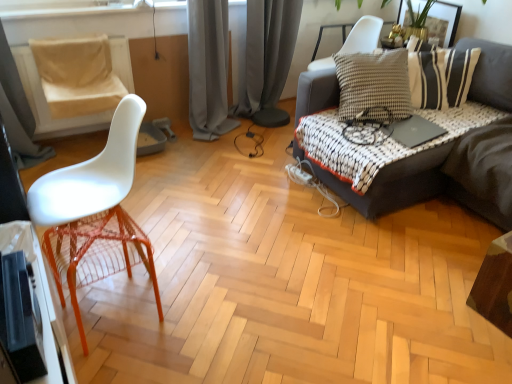
Question: From a real-world perspective, is beige fabric swivel chair at left physically located above or below dark gray fabric couch at right?

Choices:
 (A) above
 (B) below

Answer: (A)

Question: Based on their sizes in the image, would you say beige fabric swivel chair at left is bigger or smaller than dark gray fabric couch at right?

Choices:
 (A) small
 (B) big

Answer: (A)

Question: Based on their relative distances, which object is farther from the beige fabric swivel chair at left?

Choices:
 (A) gray fabric curtain at center, which is the 1th curtain from left to right
 (B) dark gray fabric couch at right
 (C) black matte laptop at upper right
 (D) white plastic chair at left
 (E) wooden table at lower right

Answer: (E)

Question: Which is nearer to the gold metallic picture frame at upper right?

Choices:
 (A) wooden table at lower right
 (B) gray fabric curtain at center, which is the 1th curtain from left to right
 (C) dark gray fabric couch at right
 (D) beige fabric swivel chair at left
 (E) gray velvet curtain at center, the first curtain from the right

Answer: (E)